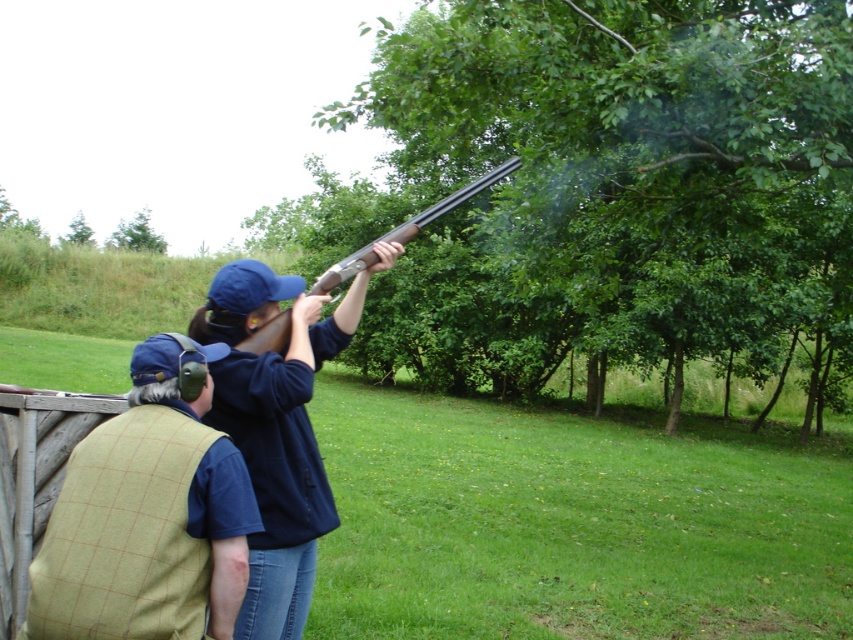
Question: Which point is closer to the camera?

Choices:
 (A) (264, 595)
 (B) (161, 477)

Answer: (B)

Question: Is green tweed vest at center behind brown wooden shotgun at upper center?

Choices:
 (A) no
 (B) yes

Answer: (A)

Question: Among these objects, which one is nearest to the camera?

Choices:
 (A) brown wooden shotgun at upper center
 (B) green tweed vest at center
 (C) blue fabric shirt at upper center

Answer: (B)

Question: Does blue fabric shirt at upper center lie behind brown wooden shotgun at upper center?

Choices:
 (A) yes
 (B) no

Answer: (B)

Question: Does green tweed vest at center appear over blue fabric shirt at upper center?

Choices:
 (A) no
 (B) yes

Answer: (A)

Question: Which point is closer to the camera taking this photo?

Choices:
 (A) (144, 376)
 (B) (225, 326)
 (C) (357, 250)

Answer: (A)